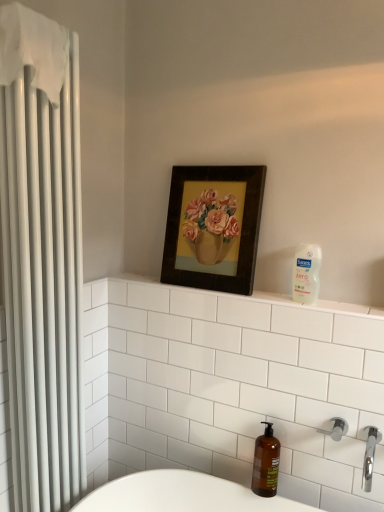
Locate an element on the screen. This screenshot has height=512, width=384. free spot to the left of white plastic bottle at upper right is located at coordinates (273, 296).